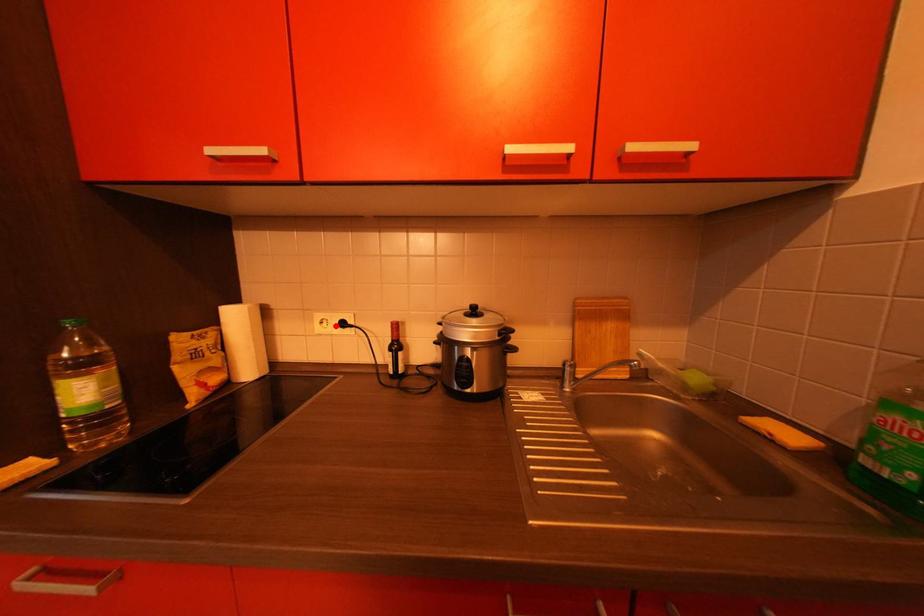
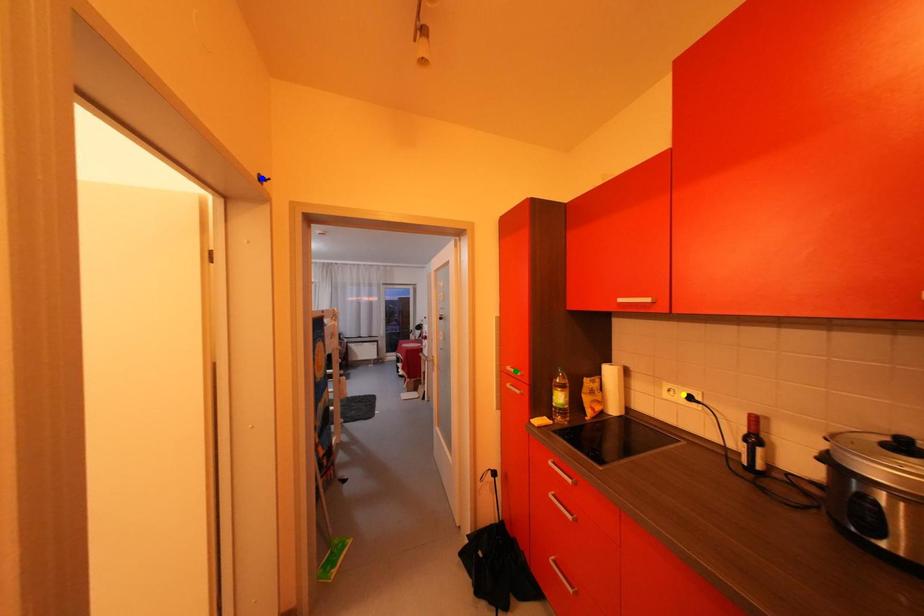
Question: I am providing you with two images of the same scene from different viewpoints. A red point is marked on the first image. You are given multiple points on the second image. Which point in image 2 is actually the same real-world point as the red point in image 1?

Choices:
 (A) yellow point
 (B) green point
 (C) blue point

Answer: (A)